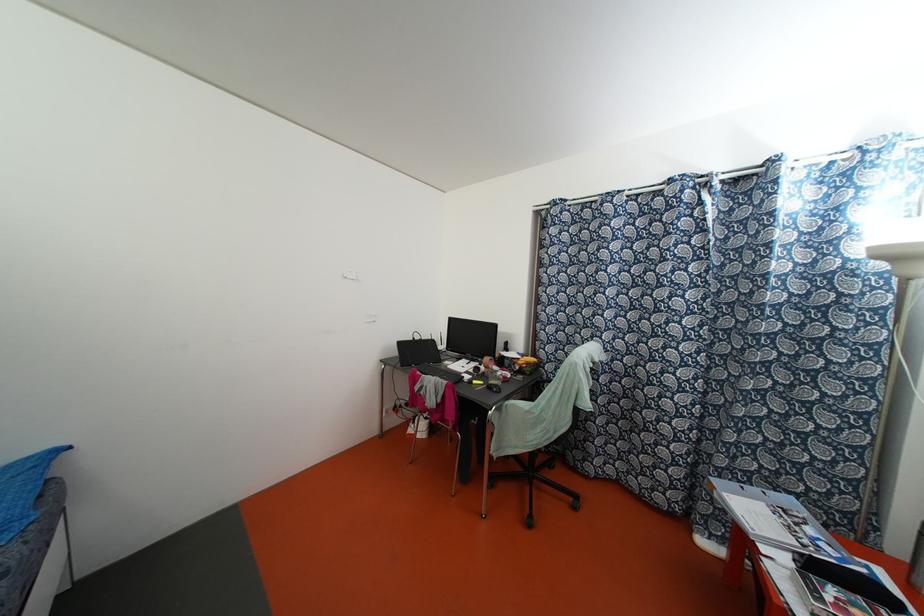
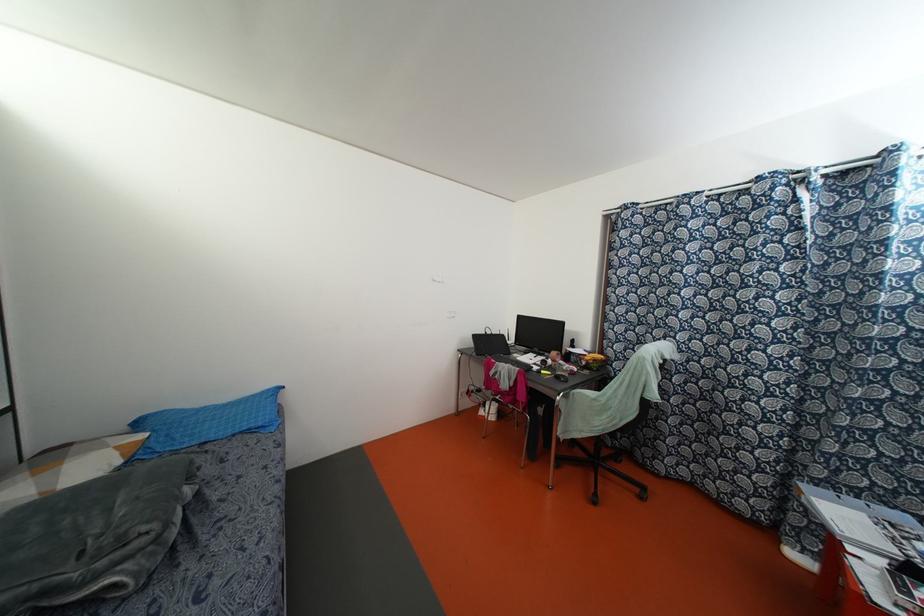
Find the pixel in the second image that matches point 527,363 in the first image.

(593, 360)